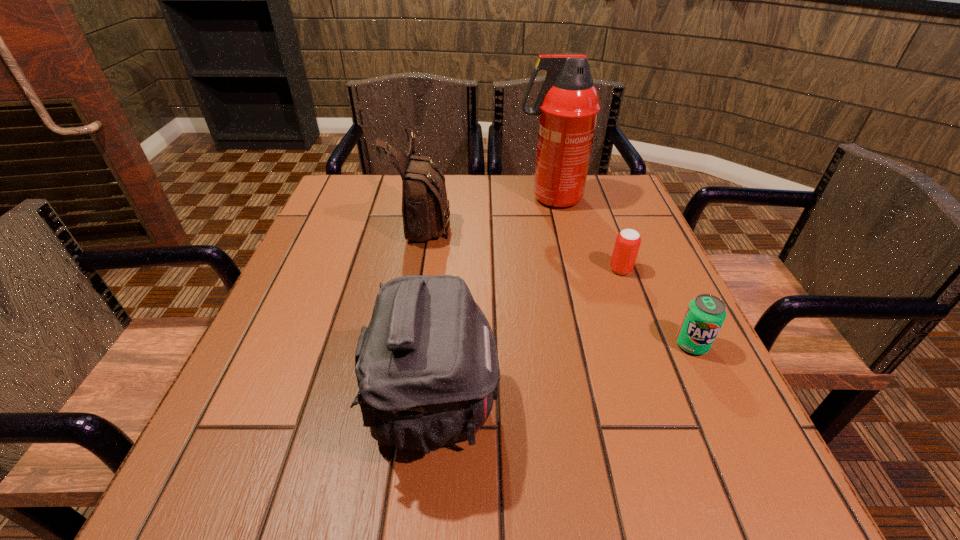
Image resolution: width=960 pixels, height=540 pixels. I want to click on the third object from right to left, so click(x=568, y=104).

At what (x,y) coordinates should I click in order to perform the action: click on the tallest object. Please return your answer as a coordinate pair (x, y). This screenshot has width=960, height=540. Looking at the image, I should click on (568, 104).

This screenshot has width=960, height=540. I want to click on the farther shoulder bag, so click(x=425, y=207).

Where is `the nearer shoulder bag`? This screenshot has width=960, height=540. the nearer shoulder bag is located at coordinates (427, 368).

Image resolution: width=960 pixels, height=540 pixels. I want to click on pop soda, so click(x=704, y=317).

Where is `beer can`? This screenshot has height=540, width=960. beer can is located at coordinates coord(628,241).

You are a GUI agent. You are given a task and a screenshot of the screen. Output one action in this format:
    pyautogui.click(x=<x>, y=<y>)
    Task: Click on the third nearest object
    
    Given the screenshot: What is the action you would take?
    pyautogui.click(x=628, y=241)

At what (x,y) coordinates should I click in order to perform the action: click on vacant space located on the trigger side of the tallest object. Please return your answer as a coordinate pair (x, y). The width and height of the screenshot is (960, 540). Looking at the image, I should click on click(x=392, y=198).

You are a GUI agent. You are given a task and a screenshot of the screen. Output one action in this format:
    pyautogui.click(x=<x>, y=<y>)
    Task: Click on the vacant space located 0.210m on the trigger side of the tallest object
    Image resolution: width=960 pixels, height=540 pixels.
    Given the screenshot: What is the action you would take?
    pyautogui.click(x=440, y=198)

Locate an element on the screen. Image resolution: width=960 pixels, height=540 pixels. free space located on the trigger side of the tallest object is located at coordinates (392, 198).